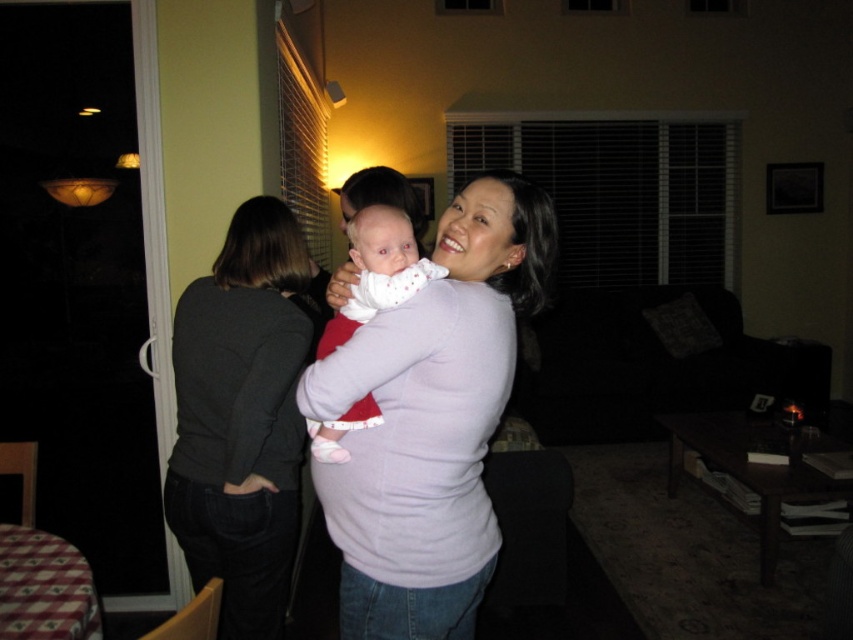
Is matte pink shirt at center wider than dark gray sweater at left?

Indeed, matte pink shirt at center has a greater width compared to dark gray sweater at left.

Locate an element on the screen. This screenshot has width=853, height=640. matte pink shirt at center is located at coordinates (431, 419).

What do you see at coordinates (431, 419) in the screenshot?
I see `matte pink shirt at center` at bounding box center [431, 419].

Identify the location of matte pink shirt at center. click(x=431, y=419).

This screenshot has width=853, height=640. What do you see at coordinates (268, 404) in the screenshot? I see `matte black sleeve at upper center` at bounding box center [268, 404].

Is the position of matte black sleeve at upper center more distant than that of white soft fabric baby at center?

Yes, matte black sleeve at upper center is further from the viewer.

Is point (254, 464) positioned after point (368, 301)?

Yes, it is behind point (368, 301).

Identify the location of matte black sleeve at upper center. (268, 404).

Does matte pink shirt at center appear over white soft fabric baby at center?

No.

This screenshot has width=853, height=640. In order to click on matte pink shirt at center in this screenshot , I will do `click(431, 419)`.

Locate an element on the screen. This screenshot has width=853, height=640. matte pink shirt at center is located at coordinates (431, 419).